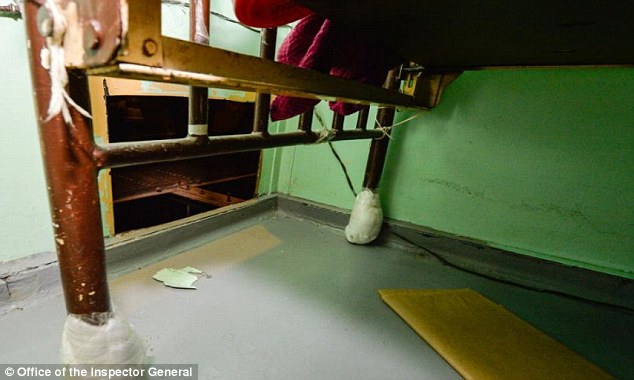
What are the coordinates of `baseboard` in the screenshot? It's located at (257, 196), (182, 111), (68, 175), (473, 252), (132, 247).